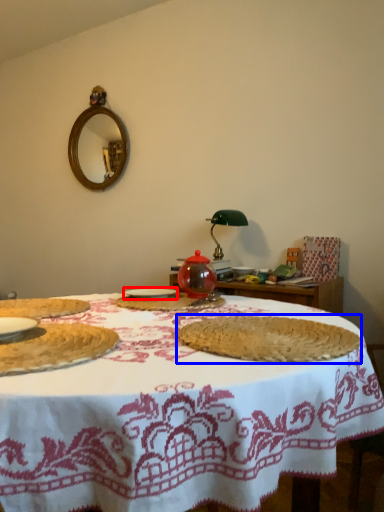
Question: Which of the following is the closest to the observer, tableware (highlighted by a red box) or food (highlighted by a blue box)?

Choices:
 (A) tableware
 (B) food

Answer: (B)